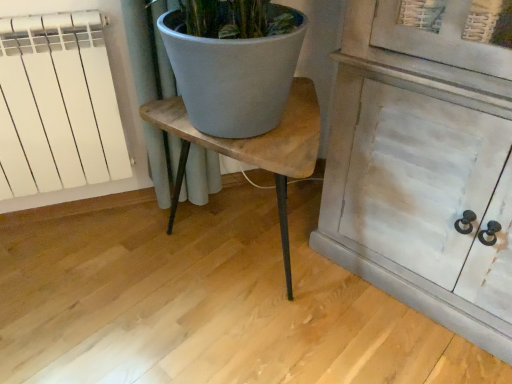
Locate an element on the screen. free location to the left of wooden table at center is located at coordinates (86, 280).